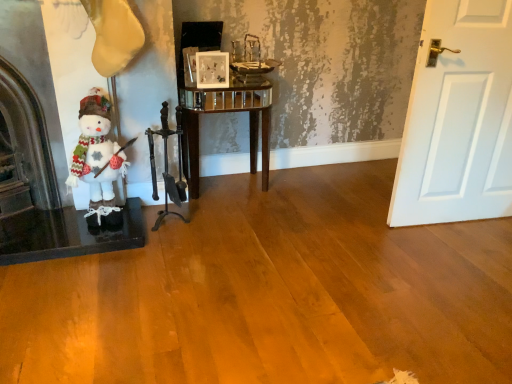
Find the location of a particular element. The width and height of the screenshot is (512, 384). free spot to the right of white fabric snowman at left is located at coordinates (150, 244).